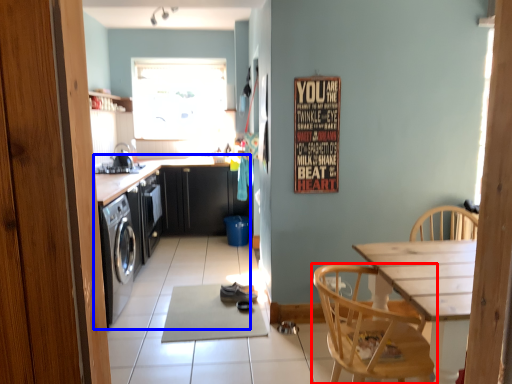
Question: Which object appears farthest to the camera in this image, chair (highlighted by a red box) or cabinetry (highlighted by a blue box)?

Choices:
 (A) chair
 (B) cabinetry

Answer: (B)